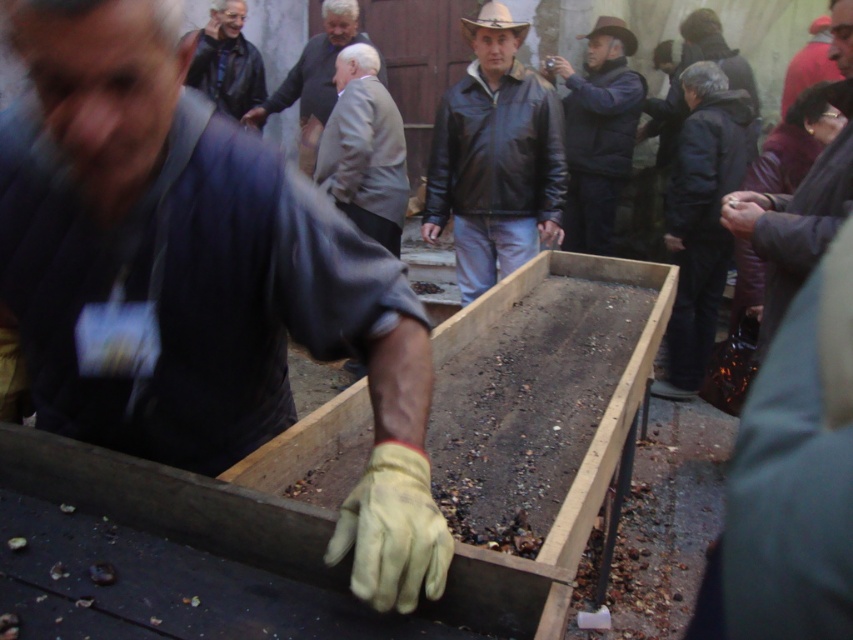
Question: Among these points, which one is nearest to the camera?

Choices:
 (A) (277, 99)
 (B) (224, 26)
 (C) (531, 216)

Answer: (C)

Question: Which of the following is the farthest from the observer?

Choices:
 (A) leather jacket at center
 (B) leather jacket at upper center
 (C) yellow leather glove at center

Answer: (B)

Question: Which point appears closest to the camera in this image?

Choices:
 (A) (347, 513)
 (B) (514, 113)
 (C) (445, 552)

Answer: (C)

Question: Is dark blue jacket at right to the left of reddish-brown leather jacket at upper right from the viewer's perspective?

Choices:
 (A) yes
 (B) no

Answer: (A)

Question: Can you confirm if yellow leather glove at lower center is smaller than leather jacket at upper center?

Choices:
 (A) yes
 (B) no

Answer: (B)

Question: Is dark brown leather jacket at right smaller than leather jacket at upper center?

Choices:
 (A) no
 (B) yes

Answer: (B)